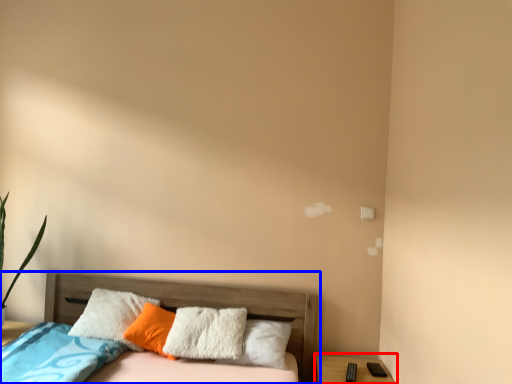
Question: Among these objects, which one is nearest to the camera, nightstand (highlighted by a red box) or bed (highlighted by a blue box)?

Choices:
 (A) nightstand
 (B) bed

Answer: (B)